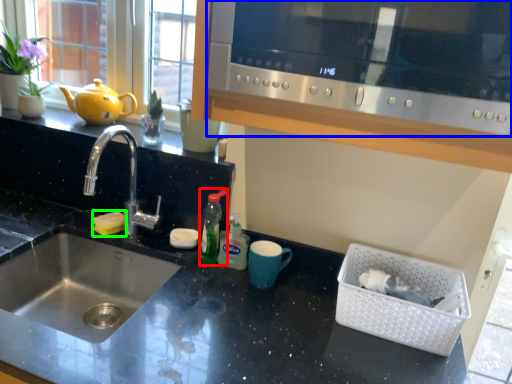
Question: Which is farther away from bottle (highlighted by a red box)? microwave (highlighted by a blue box) or food (highlighted by a green box)?

Choices:
 (A) microwave
 (B) food

Answer: (A)